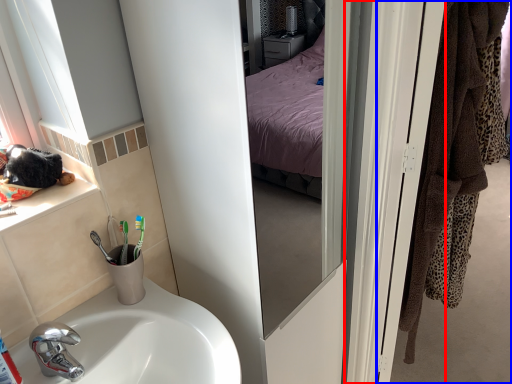
Question: Which point is further to the camera, screen door (highlighted by a red box) or door (highlighted by a blue box)?

Choices:
 (A) screen door
 (B) door

Answer: (B)